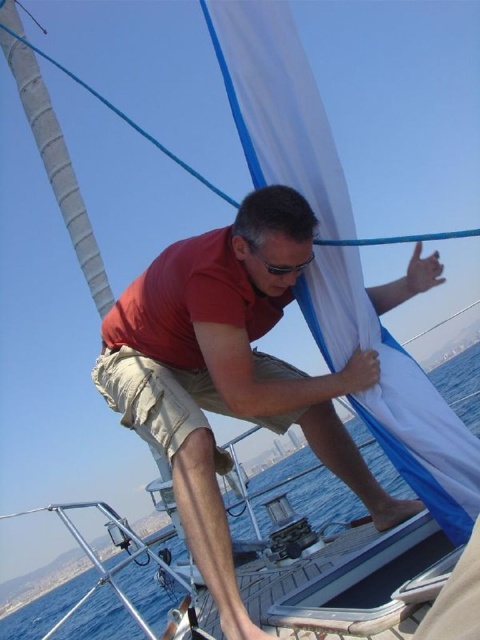
You are a safety inspector checking the boat for proper gear placement. According to regulations, the black plastic goggles at center must be within 30 inches of the red matte shirt at center to ensure quick access. Based on the image, is the current placement compliant?

The distance between the red matte shirt at center and the black plastic goggles at center is 32.77 inches, which exceeds the 30 inch regulation requirement. Therefore, the goggles are not within the required distance for quick access.

Consider the image. You are a photographer trying to capture the man adjusting the sail. You notice the red matte shirt at center and the black plastic goggles at center. Which object is located to the left when focusing on the center of the image?

The red matte shirt at center is positioned on the left side of the black plastic goggles at center, so the red matte shirt at center is to the left.

In the scene shown: Where is the red matte shirt at center located in the image?

The red matte shirt at center is located at point coordinates of approximately 0.588 on the x axis and 0.477 on the y axis.